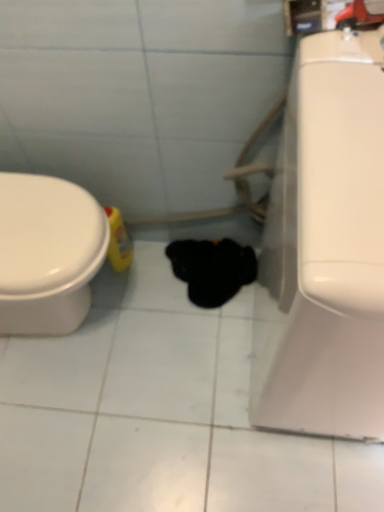
The image size is (384, 512). Find the location of `vacant region to the left of white glossy toilet at right`. vacant region to the left of white glossy toilet at right is located at coordinates [x=189, y=385].